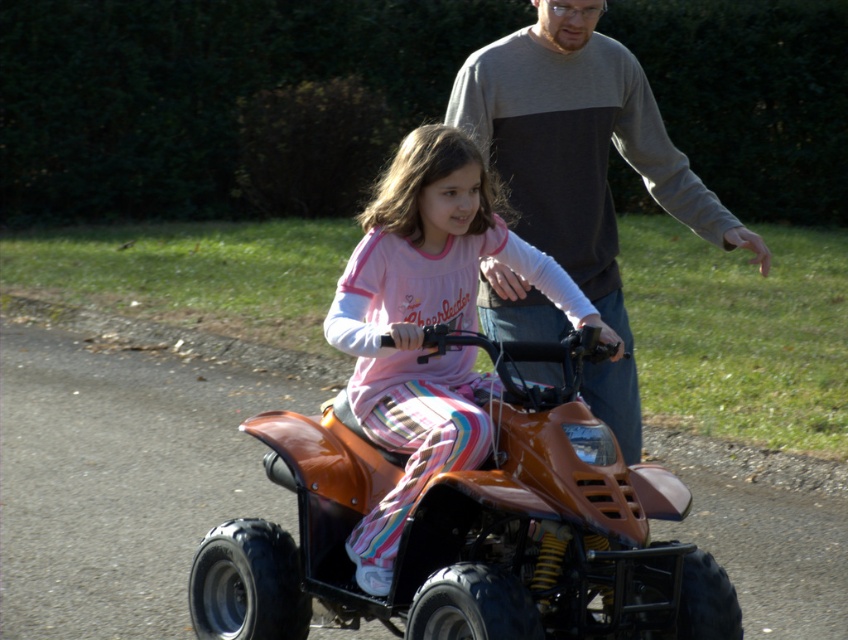
You are standing at a point in the scene and want to know how far you are from the quad bike. The quad bike is located at point (590, 513). Can you determine the distance?

The distance between point (590, 513) and the viewer is 5.11 meters, so you are 5.11 meters away from the quad bike.